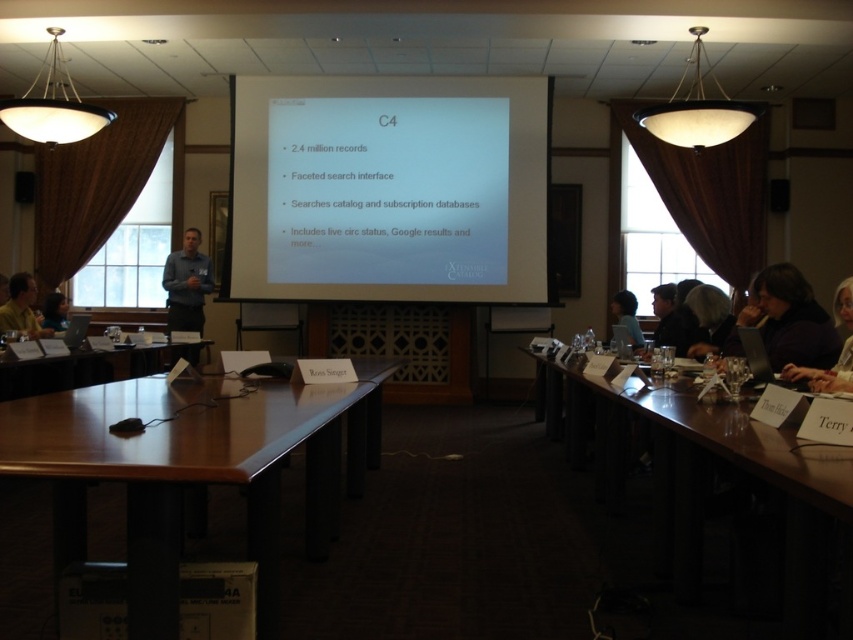
Please provide the 2D coordinates of the matte black laptop at center in the conference room scene.

The matte black laptop at center is located at the 2D coordinates of point (627, 316).

Looking at this image, you are an attendee in the conference room and want to reach the metallic projector at center without disturbing the dark purple sweater at lower right. Is there a clear path to the projector?

The dark purple sweater at lower right is in front of the metallic projector at center, so you would need to move the sweater or go around it to access the projector.

You are an attendee at the conference and want to see the presentation clearly. The white matte projector screen at center and the dark purple sweater at lower right are both in your line of sight. Which object is closer to you?

The dark purple sweater at lower right is closer to you because the white matte projector screen at center is positioned over it, indicating the screen is further away.